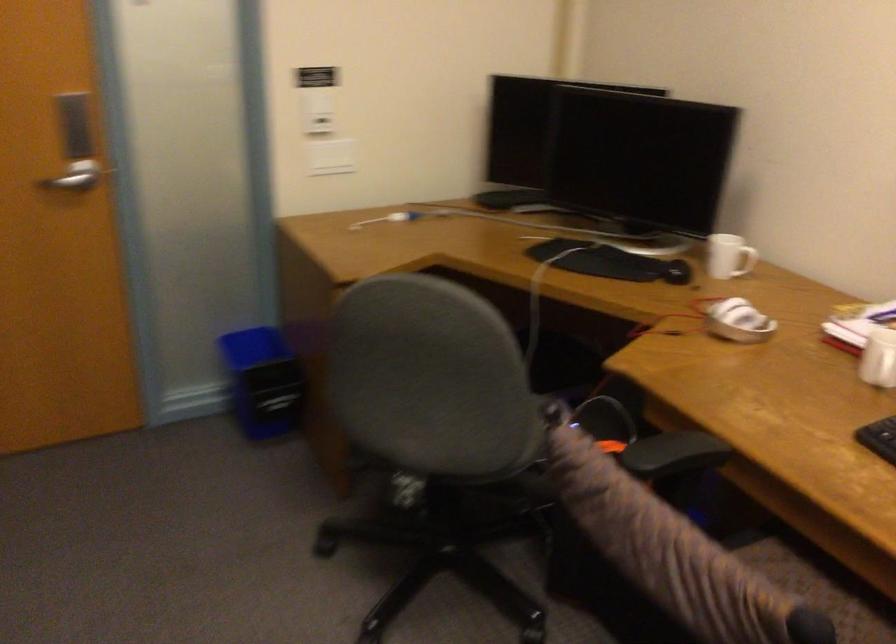
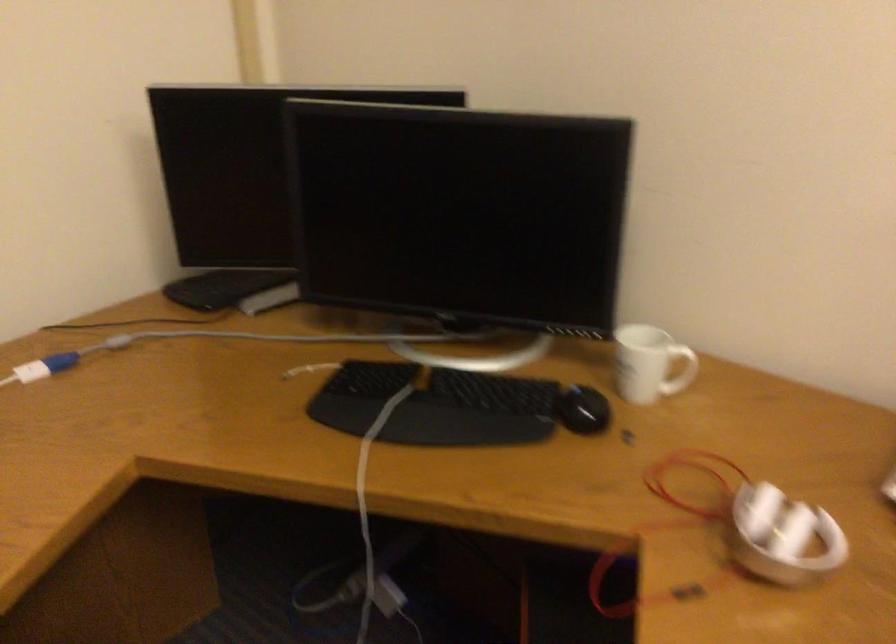
Question: What movement of the cameraman would produce the second image?

Choices:
 (A) Left
 (B) Right
 (C) Forward
 (D) Backward

Answer: (C)